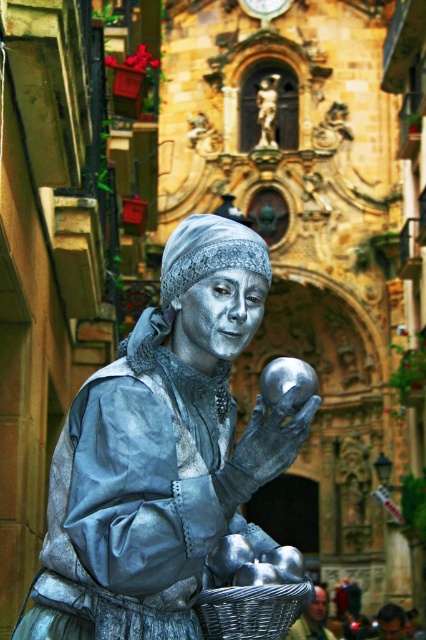
In the scene shown: You are a tourist in the town square and want to take a photo of both the metallic woven basket at lower center and the polished bronze statue at center. However, your camera can only focus on objects within a 50 meter range. Will you be able to capture both in a single shot without moving your camera?

The metallic woven basket at lower center is 73.13 meters away from the polished bronze statue at center. Since the camera can only focus within 50 meters, the distance between them exceeds the camera range. Therefore, you cannot capture both in a single shot without moving the camera.

You are an artist planning to sketch the scene. You need to ensure the proportions are accurate. Which object should you draw wider, the shiny silver statue at center or the metallic woven basket at lower center?

The shiny silver statue at center should be drawn wider than the metallic woven basket at lower center because the shiny silver statue at center is wider than the metallic woven basket at lower center according to the description.

You are a tour guide leading a group to a historic town square. You see the shiny silver statue at center and the polished bronze statue at center. Your group wants to know if they can comfortably walk between them. The average walking space required per person is 0.7 meters. How many people can walk side by side between the two statues?

The distance between the shiny silver statue at center and the polished bronze statue at center is 71.74 meters. Dividing this distance by the required 0.7 meters per person gives approximately 102 people. However, since you can only have whole people, the maximum number is 102 people.